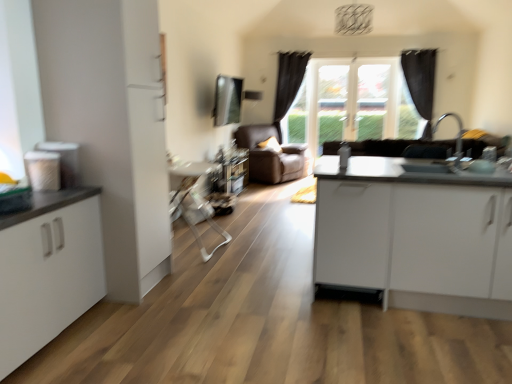
At what (x,y) coordinates should I click in order to perform the action: click on black fabric curtain at center, which is counted as the 1th curtain, starting from the left. Please return your answer as a coordinate pair (x, y). The width and height of the screenshot is (512, 384). Looking at the image, I should click on (288, 83).

This screenshot has height=384, width=512. Find the location of `white glossy sink at right`. white glossy sink at right is located at coordinates (439, 160).

Measure the distance between point (x=391, y=236) and camera.

Point (x=391, y=236) is 8.76 feet from camera.

What do you see at coordinates (271, 155) in the screenshot? This screenshot has width=512, height=384. I see `matte brown leather couch at center` at bounding box center [271, 155].

This screenshot has width=512, height=384. What do you see at coordinates (357, 99) in the screenshot?
I see `transparent glass window at center` at bounding box center [357, 99].

What do you see at coordinates (48, 270) in the screenshot? I see `white matte cabinet at left` at bounding box center [48, 270].

Where is `black fabric curtain at upper right, which appears as the 1th curtain when viewed from the right`? black fabric curtain at upper right, which appears as the 1th curtain when viewed from the right is located at coordinates (421, 83).

At what (x,y) coordinates should I click in order to perform the action: click on black fabric curtain at center, the second curtain when ordered from right to left. Please return your answer as a coordinate pair (x, y). The width and height of the screenshot is (512, 384). Looking at the image, I should click on (288, 83).

From the image's perspective, which one is positioned lower, white glossy sink at right or transparent glass window at center?

white glossy sink at right.

Does point (459, 143) come closer to viewer compared to point (278, 76)?

Yes, point (459, 143) is closer to viewer.

Between white glossy sink at right and transparent glass window at center, which one appears on the left side from the viewer's perspective?

From the viewer's perspective, white glossy sink at right appears more on the left side.

At what (x,y) coordinates should I click in order to perform the action: click on window above the white glossy sink at right (from the image's perspective). Please return your answer as a coordinate pair (x, y). The image size is (512, 384). Looking at the image, I should click on click(357, 99).

The width and height of the screenshot is (512, 384). What are the coordinates of `sink lying in front of the black fabric curtain at center, which is counted as the 1th curtain, starting from the left` in the screenshot? It's located at (439, 160).

Is white glossy sink at right directly adjacent to black fabric curtain at center, which is counted as the 1th curtain, starting from the left?

No, white glossy sink at right is not with black fabric curtain at center, which is counted as the 1th curtain, starting from the left.

Is white glossy sink at right spatially inside black fabric curtain at center, which is counted as the 1th curtain, starting from the left, or outside of it?

The correct answer is: outside.

Considering the points (409, 150) and (304, 52), which point is in front, point (409, 150) or point (304, 52)?

The point (409, 150) is more forward.

Which object is further away from the camera, white matte cabinet at left or transparent glass window at center?

transparent glass window at center is further from the camera.

From the image's perspective, which one is positioned lower, white matte cabinet at left or transparent glass window at center?

From the image's view, white matte cabinet at left is below.

Who is taller, white matte cabinet at left or transparent glass window at center?

transparent glass window at center.

Considering the sizes of metallic silver table at center, which is counted as the second table, starting from the right, and white matte cabinet at left in the image, is metallic silver table at center, which is counted as the second table, starting from the right, bigger or smaller than white matte cabinet at left?

Considering their sizes, metallic silver table at center, which is counted as the second table, starting from the right, takes up more space than white matte cabinet at left.

Does point (182, 198) appear closer or farther from the camera than point (48, 232)?

Point (182, 198) is positioned farther from the camera compared to point (48, 232).

Where is `the 1st table counting from the right of the white matte cabinet at left`? the 1st table counting from the right of the white matte cabinet at left is located at coordinates (195, 201).

Based on the photo, between transparent glass window at center and white glossy sink at right, which one has more height?

Result: With more height is transparent glass window at center.

Based on the photo, from the image's perspective, is transparent glass window at center located above or below white glossy sink at right?

Based on their image positions, transparent glass window at center is located above white glossy sink at right.

Are transparent glass window at center and white glossy sink at right beside each other?

No, transparent glass window at center is not touching white glossy sink at right.

Is transparent glass window at center wider or thinner than white glossy sink at right?

Clearly, transparent glass window at center has less width compared to white glossy sink at right.

From a real-world perspective, is white matte cabinet at left under metallic silver table at center, which is counted as the 1th table, starting from the left?

Yes, from a real-world perspective, white matte cabinet at left is below metallic silver table at center, which is counted as the 1th table, starting from the left.

Does white matte cabinet at left have a lesser height compared to metallic silver table at center, which is counted as the second table, starting from the right?

Yes.

Does white matte cabinet at left lie in front of metallic silver table at center, which is counted as the 1th table, starting from the left?

Yes, white matte cabinet at left is closer to the camera.

Image resolution: width=512 pixels, height=384 pixels. I want to click on cabinetry on the left of metallic silver table at center, which is counted as the 1th table, starting from the left, so click(x=48, y=270).

From the image's perspective, between metallic silver table at center, which is counted as the 1th table, starting from the left, and black fabric curtain at center, which is counted as the 1th curtain, starting from the left, which one is located above?

black fabric curtain at center, which is counted as the 1th curtain, starting from the left, appears higher in the image.

Are metallic silver table at center, which is counted as the 1th table, starting from the left, and black fabric curtain at center, the second curtain when ordered from right to left, making contact?

No, metallic silver table at center, which is counted as the 1th table, starting from the left, is not with black fabric curtain at center, the second curtain when ordered from right to left.

How different are the orientations of metallic silver table at center, which is counted as the second table, starting from the right, and black fabric curtain at center, the second curtain when ordered from right to left, in degrees?

90.9 degrees.

Does metallic silver table at center, which is counted as the second table, starting from the right, turn towards black fabric curtain at center, the second curtain when ordered from right to left?

No, metallic silver table at center, which is counted as the second table, starting from the right, is not aimed at black fabric curtain at center, the second curtain when ordered from right to left.

Identify the location of sink on the left of transparent glass window at center. This screenshot has width=512, height=384. pos(439,160).

This screenshot has height=384, width=512. I want to click on curtain that is the 2nd object located behind the white glossy sink at right, so click(x=288, y=83).

Estimate the real-world distances between objects in this image. Which object is further from matte brown leather couch at center, white matte cabinet at left or black fabric curtain at upper right, which appears as the 1th curtain when viewed from the right?

Among the two, white matte cabinet at left is located further to matte brown leather couch at center.

In the scene shown: Based on their spatial positions, is metallic silver table at center, which is counted as the 1th table, starting from the left, or white glossy cabinet at right, acting as the second table starting from the left, closer to white matte cabinet at left?

metallic silver table at center, which is counted as the 1th table, starting from the left, lies closer to white matte cabinet at left than the other object.

Looking at the image, which one is located further to white glossy sink at right, white matte cabinet at left or metallic silver table at center, which is counted as the 1th table, starting from the left?

metallic silver table at center, which is counted as the 1th table, starting from the left.

Estimate the real-world distances between objects in this image. Which object is closer to black fabric curtain at upper right, which appears as the 1th curtain when viewed from the right, white glossy sink at right or black fabric curtain at center, the second curtain when ordered from right to left?

black fabric curtain at center, the second curtain when ordered from right to left.

Based on their spatial positions, is white glossy cabinet at right, the first table when ordered from right to left, or metallic silver table at center, which is counted as the 1th table, starting from the left, further from transparent glass window at center?

white glossy cabinet at right, the first table when ordered from right to left, is positioned further to the anchor transparent glass window at center.

Which object lies further to the anchor point matte brown leather couch at center, black fabric curtain at upper right, which appears as the 2th curtain when viewed from the left, or black fabric curtain at center, which is counted as the 1th curtain, starting from the left?

black fabric curtain at upper right, which appears as the 2th curtain when viewed from the left, lies further to matte brown leather couch at center than the other object.

When comparing their distances from transparent glass window at center, does white glossy cabinet at right, the first table when ordered from right to left, or white matte cabinet at left seem further?

The object further to transparent glass window at center is white matte cabinet at left.

When comparing their distances from transparent glass window at center, does black fabric curtain at upper right, which appears as the 1th curtain when viewed from the right, or metallic silver table at center, which is counted as the 1th table, starting from the left, seem closer?

black fabric curtain at upper right, which appears as the 1th curtain when viewed from the right, lies closer to transparent glass window at center than the other object.

Locate an element on the screen. The image size is (512, 384). table between white glossy sink at right and matte brown leather couch at center from front to back is located at coordinates (195, 201).

Find the location of `window located between black fabric curtain at center, which is counted as the 1th curtain, starting from the left, and black fabric curtain at upper right, which appears as the 2th curtain when viewed from the left, in the left-right direction`. window located between black fabric curtain at center, which is counted as the 1th curtain, starting from the left, and black fabric curtain at upper right, which appears as the 2th curtain when viewed from the left, in the left-right direction is located at coordinates (357, 99).

I want to click on sink located between white glossy cabinet at right, acting as the second table starting from the left, and black fabric curtain at upper right, which appears as the 2th curtain when viewed from the left, in the depth direction, so click(439, 160).

Where is `table situated between metallic silver table at center, which is counted as the second table, starting from the right, and white glossy sink at right from left to right`? The width and height of the screenshot is (512, 384). table situated between metallic silver table at center, which is counted as the second table, starting from the right, and white glossy sink at right from left to right is located at coordinates (415, 235).